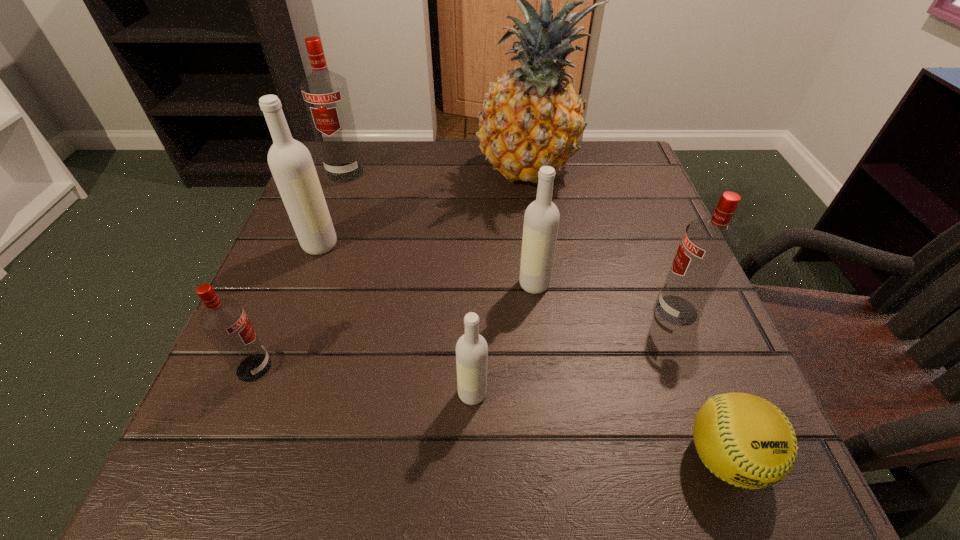
This screenshot has height=540, width=960. I want to click on the smallest red vodka, so click(x=225, y=323).

The width and height of the screenshot is (960, 540). In order to click on the nearest white vodka in this screenshot , I will do `click(471, 348)`.

Identify the location of the smallest white vodka. (471, 348).

Locate an element on the screen. The width and height of the screenshot is (960, 540). softball is located at coordinates (745, 440).

You are a GUI agent. You are given a task and a screenshot of the screen. Output one action in this format:
    pyautogui.click(x=<x>, y=<y>)
    Task: Click on the nearest object
    
    Given the screenshot: What is the action you would take?
    pyautogui.click(x=745, y=440)

Image resolution: width=960 pixels, height=540 pixels. Find the location of `blank space located 0.060m on the front of the tallest object`. blank space located 0.060m on the front of the tallest object is located at coordinates (537, 217).

Image resolution: width=960 pixels, height=540 pixels. Identify the location of vacant space located 0.360m on the back of the biggest white vodka. (358, 144).

The image size is (960, 540). I want to click on vacant area situated on the front label of the farthest vodka, so click(x=321, y=237).

You are a GUI agent. You are given a task and a screenshot of the screen. Output one action in this format:
    pyautogui.click(x=<x>, y=<y>)
    Task: Click on the free space located 0.050m on the back of the second farthest white vodka
    The image size is (960, 540).
    Given the screenshot: What is the action you would take?
    pyautogui.click(x=531, y=254)

Where is `blank space located 0.320m on the front label of the rightmost vodka`? The height and width of the screenshot is (540, 960). blank space located 0.320m on the front label of the rightmost vodka is located at coordinates (468, 310).